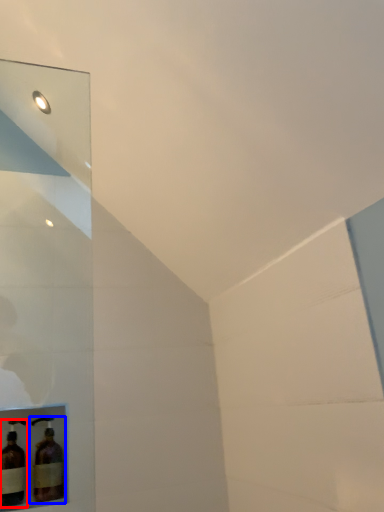
Question: Which point is closer to the camera, bottle (highlighted by a red box) or bottle (highlighted by a blue box)?

Choices:
 (A) bottle
 (B) bottle

Answer: (A)